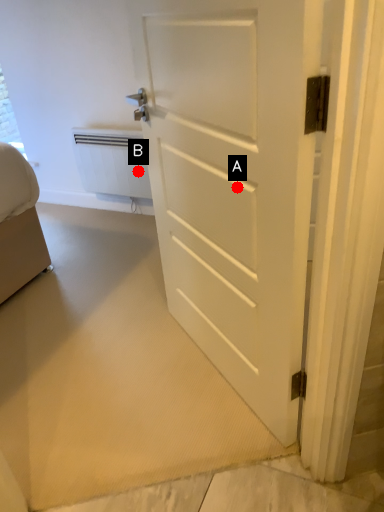
Question: Two points are circled on the image, labeled by A and B beside each circle. Among these points, which one is nearest to the camera?

Choices:
 (A) A is closer
 (B) B is closer

Answer: (A)